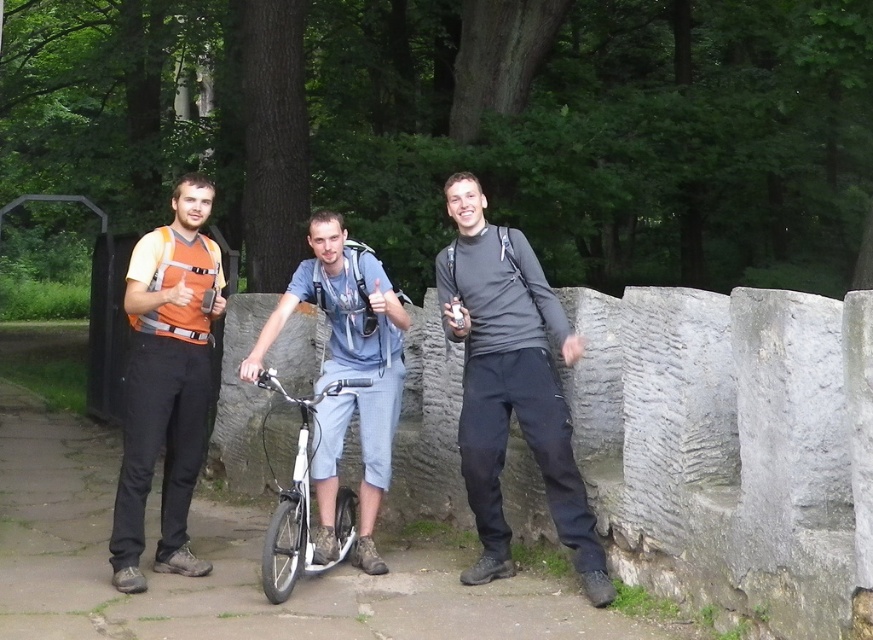
Between point (131, 385) and point (344, 509), which one is positioned behind?

The point (344, 509) is behind.

Is matte orange shirt at left shorter than white matte bicycle at center?

No, matte orange shirt at left is not shorter than white matte bicycle at center.

Image resolution: width=873 pixels, height=640 pixels. Describe the element at coordinates (166, 381) in the screenshot. I see `matte orange shirt at left` at that location.

The width and height of the screenshot is (873, 640). I want to click on matte orange shirt at left, so click(x=166, y=381).

Who is positioned more to the left, dark gray matte pants at center or white matte bicycle at center?

Positioned to the left is white matte bicycle at center.

Between dark gray matte pants at center and white matte bicycle at center, which one appears on the right side from the viewer's perspective?

dark gray matte pants at center

Who is more distant from viewer, (x=478, y=561) or (x=340, y=554)?

Point (x=478, y=561)

I want to click on dark gray matte pants at center, so click(511, 385).

Does dark gray matte pants at center appear under matte orange shirt at left?

Correct, dark gray matte pants at center is located below matte orange shirt at left.

Identify the location of dark gray matte pants at center. (511, 385).

Locate an element on the screen. The height and width of the screenshot is (640, 873). dark gray matte pants at center is located at coordinates (511, 385).